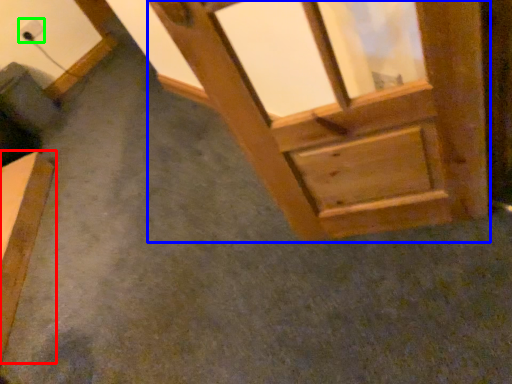
Question: Considering the real-world distances, which object is farthest from furniture (highlighted by a red box)? window frame (highlighted by a blue box) or electric outlet (highlighted by a green box)?

Choices:
 (A) window frame
 (B) electric outlet

Answer: (A)